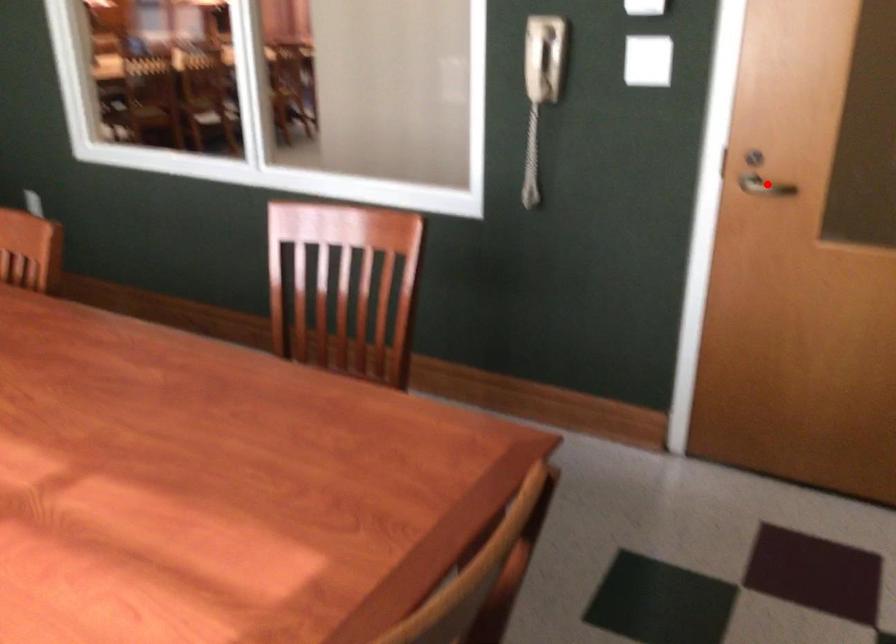
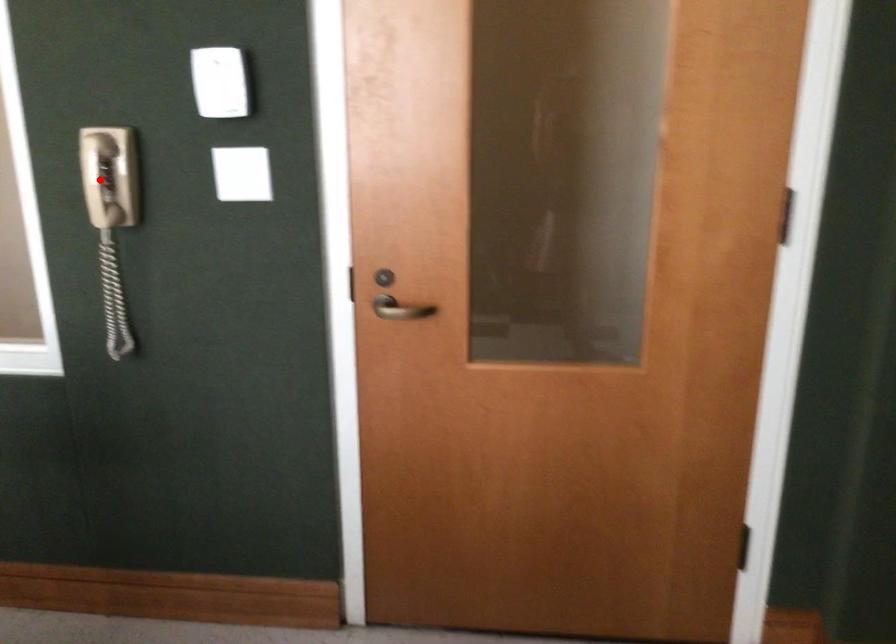
In the scene shown: I am providing you with two images of the same scene from different viewpoints. A red point is marked on the first image and another point is marked on the second image. Is the red point in image1 aligned with the point shown in image2?

No